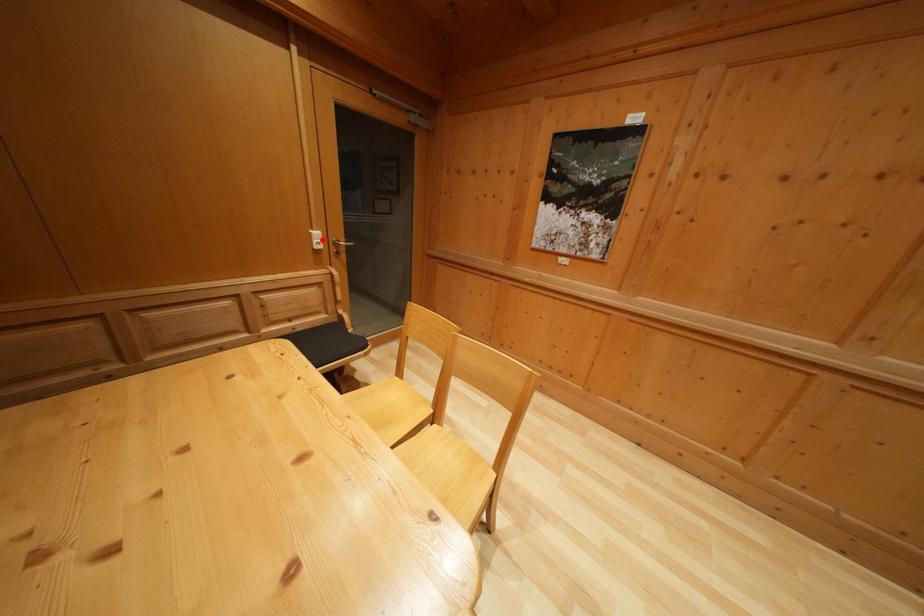
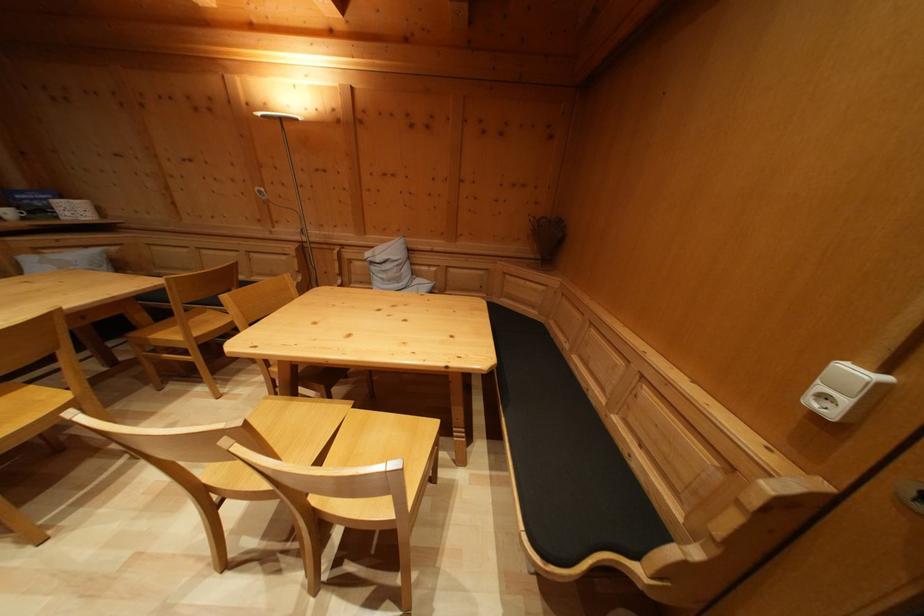
Locate, in the second image, the point that corresponds to the highlighted location in the first image.

(859, 379)